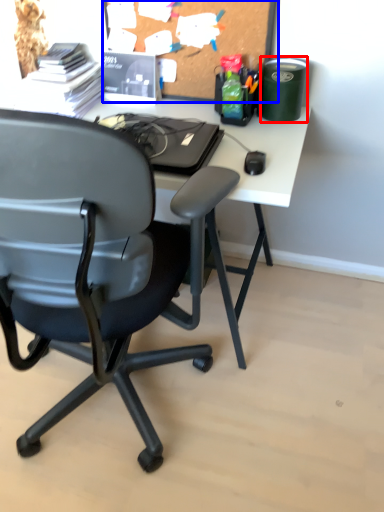
Question: Which of the following is the farthest to the observer, stationery (highlighted by a red box) or bulletin board (highlighted by a blue box)?

Choices:
 (A) stationery
 (B) bulletin board

Answer: (A)